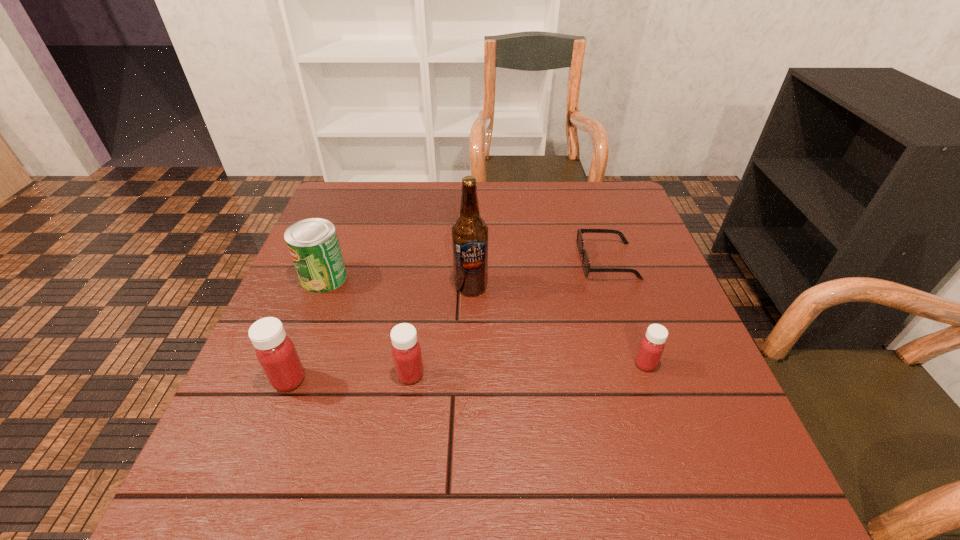
I want to click on blank space that satisfies the following two spatial constraints: 1. on the back side of the second shortest object; 2. on the front-facing side of the sunglasses, so click(x=611, y=261).

The width and height of the screenshot is (960, 540). I want to click on vacant point that satisfies the following two spatial constraints: 1. on the label of the rightmost medicine; 2. on the right side of the tallest object, so click(469, 364).

Identify the location of free space that satisfies the following two spatial constraints: 1. on the label of the third object from right to left; 2. on the left side of the shortest medicine. (469, 364).

Find the location of `vacant space that satisfies the following two spatial constraints: 1. on the label of the second shortest object; 2. on the right side of the tallest object`. vacant space that satisfies the following two spatial constraints: 1. on the label of the second shortest object; 2. on the right side of the tallest object is located at coordinates (469, 364).